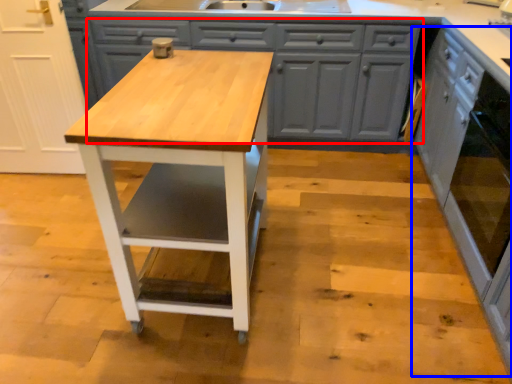
Question: Among these objects, which one is nearest to the camera, cabinetry (highlighted by a red box) or cabinetry (highlighted by a blue box)?

Choices:
 (A) cabinetry
 (B) cabinetry

Answer: (B)